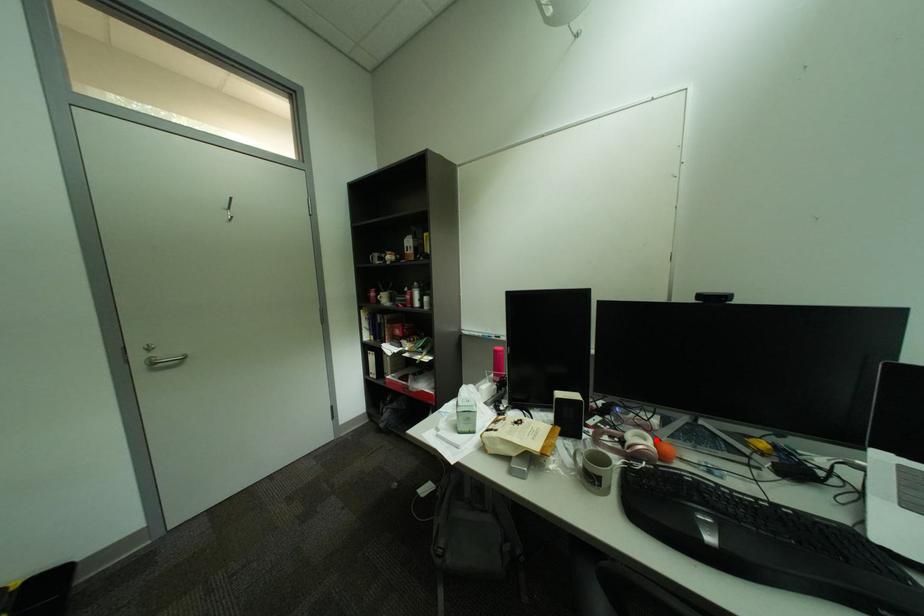
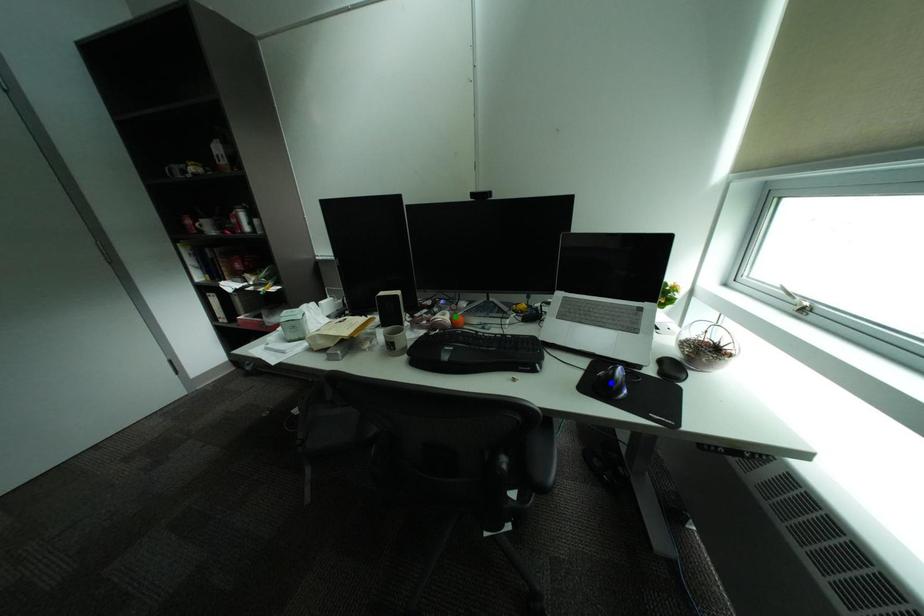
Question: I am providing you with two images of the same scene from different viewpoints. A red point is marked on the first image. You are given multiple points on the second image. Which spot in image 2 lines up with the point in image 1?

Choices:
 (A) green point
 (B) yellow point
 (C) blue point

Answer: (A)